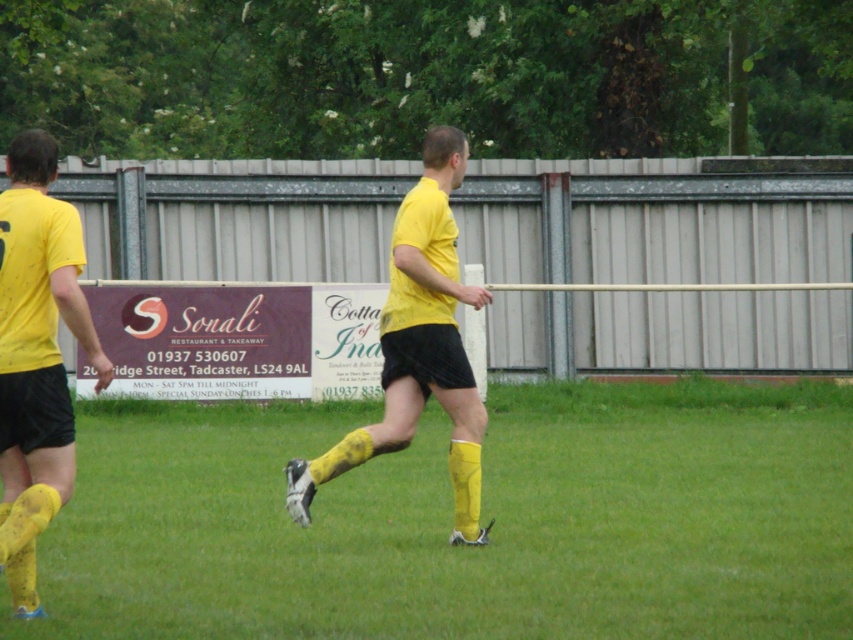
Question: Which point is closer to the camera taking this photo?

Choices:
 (A) (35, 342)
 (B) (402, 326)

Answer: (A)

Question: Is green grass at center positioned behind yellow matte shorts at center?

Choices:
 (A) yes
 (B) no

Answer: (B)

Question: Which point is farther to the camera?

Choices:
 (A) (425, 182)
 (B) (811, 620)

Answer: (A)

Question: Does green grass at center appear under yellow matte shorts at center?

Choices:
 (A) no
 (B) yes

Answer: (B)

Question: Is green grass at center to the right of yellow matte shorts at left from the viewer's perspective?

Choices:
 (A) no
 (B) yes

Answer: (B)

Question: Which point is farther to the camera?

Choices:
 (A) yellow matte shorts at center
 (B) green grass at center
 (C) yellow matte shorts at left

Answer: (A)